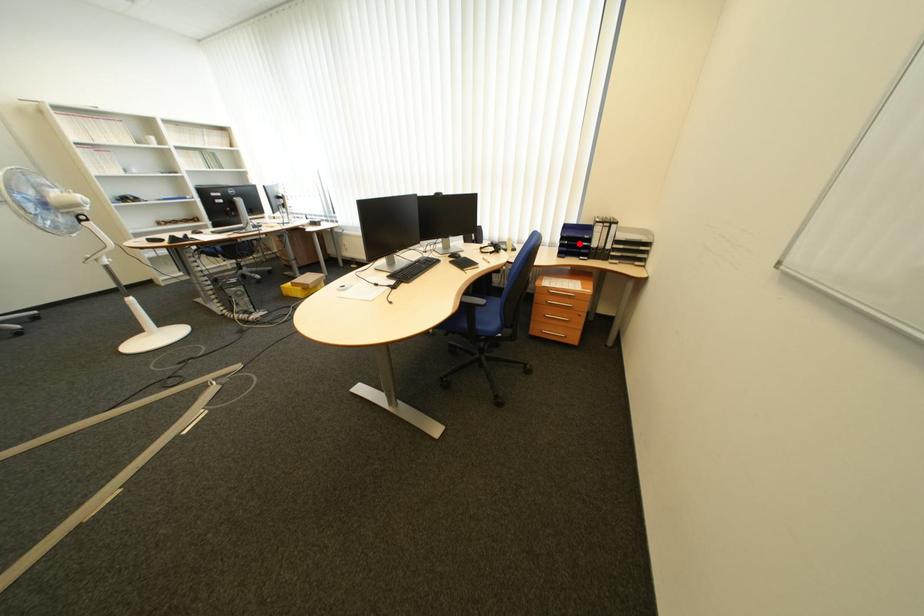
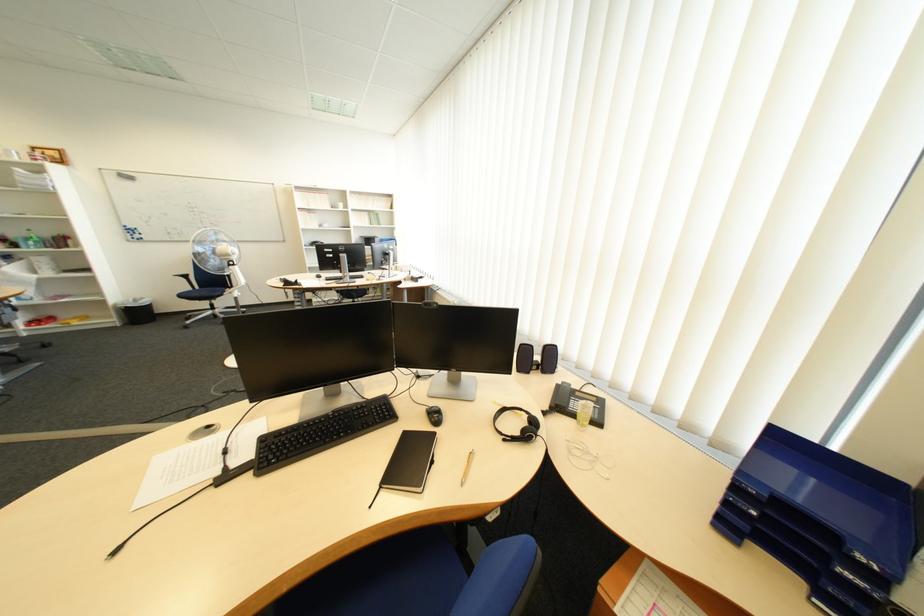
Question: I am providing you with two images of the same scene from different viewpoints. Image1 has a red point marked. In image2, the corresponding 3D location appears at what relative position? Reply with the corresponding letter.

Choices:
 (A) Closer
 (B) Farther

Answer: (B)